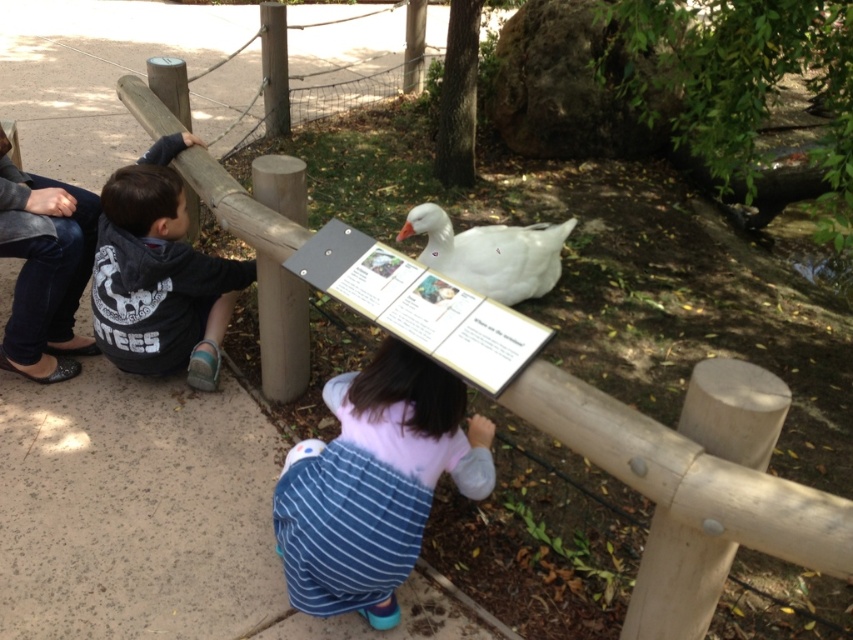
You are a zoo visitor who wants to take a photo of the striped denim dress at center and dark gray hoodie at left. To ensure both are fully visible in the frame, which object should you position closer to the camera?

The striped denim dress at center is wider than the dark gray hoodie at left, so you should position the striped denim dress at center closer to the camera to ensure both fit within the frame.

You are a photographer trying to capture a photo of the striped denim dress at center and the dark gray hoodie at left. Based on their positions, which object should you focus on first to ensure both are in the frame?

The striped denim dress at center is to the right of the dark gray hoodie at left. To include both in the frame, focus on the dark gray hoodie at left first, then adjust to include the striped denim dress at center to the right of it.

You are standing at point (502, 262) and want to walk to the point (294, 570). Which direction should you move relative to your current position?

You should move forward to reach point (294, 570) from point (502, 262) because it is in front of you.